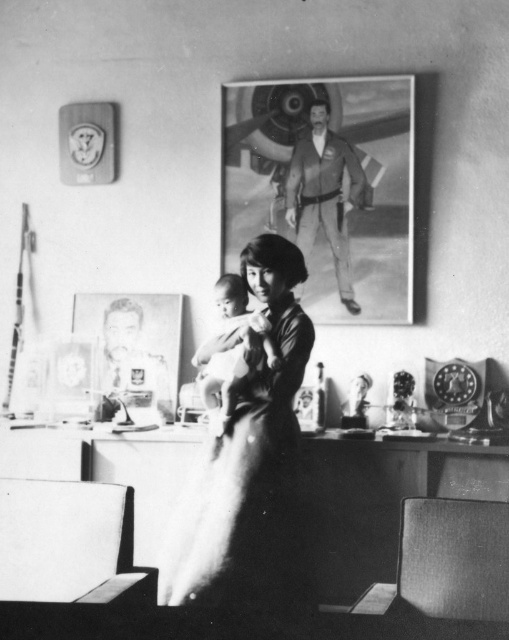
Who is positioned more to the left, smooth paper portrait at upper center or smooth fabric dress at center?

smooth fabric dress at center

Who is more forward, (357, 284) or (240, 564)?

Point (240, 564) is in front.

The width and height of the screenshot is (509, 640). Find the location of `smooth paper portrait at upper center`. smooth paper portrait at upper center is located at coordinates tap(326, 188).

In the scene shown: Who is taller, smooth fabric dress at center or smooth leather jacket at upper center?

smooth fabric dress at center

Does point (280, 534) lie in front of point (334, 154)?

Yes, it is in front of point (334, 154).

What do you see at coordinates (249, 461) in the screenshot? This screenshot has width=509, height=640. I see `smooth fabric dress at center` at bounding box center [249, 461].

Where is `smooth fabric dress at center`? Image resolution: width=509 pixels, height=640 pixels. smooth fabric dress at center is located at coordinates (249, 461).

Identify the location of smooth leather jacket at upper center. The width and height of the screenshot is (509, 640). (324, 193).

At what (x,y) coordinates should I click in order to perform the action: click on smooth leather jacket at upper center. Please return your answer as a coordinate pair (x, y). The height and width of the screenshot is (640, 509). Looking at the image, I should click on (324, 193).